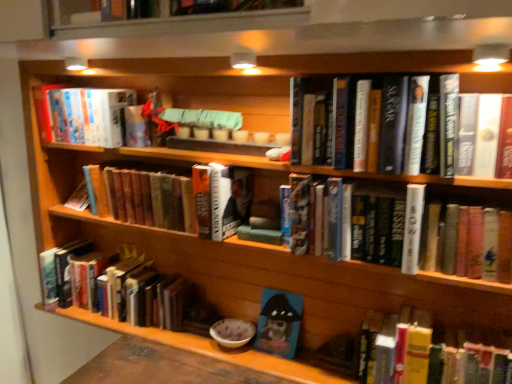
What is the approximate height of hardcover book at center, the second book in the top-to-bottom sequence?

10.00 inches.

What are the coordinates of `hardcover books at upper left, the 1th book when ordered from top to bottom` in the screenshot? It's located at (82, 114).

What is the approximate height of hardcover books at upper left, positioned as the 6th book in bottom-to-top order?

The height of hardcover books at upper left, positioned as the 6th book in bottom-to-top order, is 9.23 inches.

In order to click on blue textured canvas at center, which ranks as the first book in bottom-to-top order in this screenshot , I will do 279,323.

Is blue textured canvas at center, arranged as the sixth book when viewed from the top, far from hardcover book at center, positioned as the 5th book in bottom-to-top order?

They are positioned close to each other.

Between blue textured canvas at center, arranged as the sixth book when viewed from the top, and hardcover book at center, the second book in the top-to-bottom sequence, which one has smaller size?

Smaller between the two is blue textured canvas at center, arranged as the sixth book when viewed from the top.

From the picture: From the image's perspective, relative to hardcover book at center, positioned as the 5th book in bottom-to-top order, is blue textured canvas at center, which ranks as the first book in bottom-to-top order, above or below?

blue textured canvas at center, which ranks as the first book in bottom-to-top order, is situated lower than hardcover book at center, positioned as the 5th book in bottom-to-top order, in the image.

From the image's perspective, relative to hardcover book at center, the 4th book from the top, is hardcover books at upper left, the 1th book when ordered from top to bottom, above or below?

From the image's perspective, hardcover books at upper left, the 1th book when ordered from top to bottom, appears above hardcover book at center, the 4th book from the top.

From a real-world perspective, who is located higher, hardcover books at upper left, the 1th book when ordered from top to bottom, or hardcover book at center, the 4th book from the top?

hardcover books at upper left, the 1th book when ordered from top to bottom, from a real-world perspective.

Which object is positioned more to the right, hardcover books at upper left, positioned as the 6th book in bottom-to-top order, or hardcover book at center, which is the 3th book from bottom to top?

Positioned to the right is hardcover book at center, which is the 3th book from bottom to top.

Which is closer to the camera, (82, 106) or (356, 230)?

Point (82, 106) is positioned farther from the camera compared to point (356, 230).

How far apart are blue textured canvas at center, which ranks as the first book in bottom-to-top order, and hardcover book at lower left, the 2th book positioned from the bottom?

19.43 inches.

Is hardcover book at lower left, the 2th book positioned from the bottom, located within blue textured canvas at center, which ranks as the first book in bottom-to-top order?

Actually, hardcover book at lower left, the 2th book positioned from the bottom, is outside blue textured canvas at center, which ranks as the first book in bottom-to-top order.

Is blue textured canvas at center, arranged as the sixth book when viewed from the top, positioned far away from hardcover book at lower left, the 5th book positioned from the top?

No, blue textured canvas at center, arranged as the sixth book when viewed from the top, is not far from hardcover book at lower left, the 5th book positioned from the top.

From a real-world perspective, which is physically above, blue textured canvas at center, arranged as the sixth book when viewed from the top, or hardcover book at lower left, the 2th book positioned from the bottom?

In real-world perspective, hardcover book at lower left, the 2th book positioned from the bottom, is above.

From the image's perspective, between hardcover book at center, the 4th book from the top, and hardcover book at center, positioned as the 4th book in bottom-to-top order, which one is located above?

hardcover book at center, positioned as the 4th book in bottom-to-top order, appears higher in the image.

Which of these two, hardcover book at center, which is the 3th book from bottom to top, or hardcover book at center, positioned as the 3th book in top-to-bottom order, is thinner?

With smaller width is hardcover book at center, which is the 3th book from bottom to top.

You are a GUI agent. You are given a task and a screenshot of the screen. Output one action in this format:
    pyautogui.click(x=<x>, y=<y>)
    Task: Click on the 3rd book counting from the right side of the hardcover book at center, positioned as the 3th book in top-to-bottom order
    This screenshot has width=512, height=384.
    Given the screenshot: What is the action you would take?
    pyautogui.click(x=466, y=241)

Between hardcover book at center, the 4th book from the top, and hardcover book at center, positioned as the 4th book in bottom-to-top order, which one has more height?

Standing taller between the two is hardcover book at center, the 4th book from the top.

How different are the orientations of hardcover book at lower left, the 2th book positioned from the bottom, and blue textured canvas at center, which ranks as the first book in bottom-to-top order, in degrees?

The facing directions of hardcover book at lower left, the 2th book positioned from the bottom, and blue textured canvas at center, which ranks as the first book in bottom-to-top order, are 0.00258 degrees apart.

Which book is the 2nd one when counting from the right side of the hardcover book at lower left, the 5th book positioned from the top? Please provide its 2D coordinates.

[(279, 323)]

Considering the sizes of objects hardcover book at lower left, the 5th book positioned from the top, and blue textured canvas at center, which ranks as the first book in bottom-to-top order, in the image provided, who is taller, hardcover book at lower left, the 5th book positioned from the top, or blue textured canvas at center, which ranks as the first book in bottom-to-top order,?

hardcover book at lower left, the 5th book positioned from the top, is taller.

How much distance is there between hardcover book at center, positioned as the 4th book in bottom-to-top order, and hardcover books at upper left, positioned as the 6th book in bottom-to-top order?

They are 25.35 centimeters apart.

Can you see hardcover book at center, positioned as the 4th book in bottom-to-top order, touching hardcover books at upper left, positioned as the 6th book in bottom-to-top order?

No, hardcover book at center, positioned as the 4th book in bottom-to-top order, is not with hardcover books at upper left, positioned as the 6th book in bottom-to-top order.

From a real-world perspective, is hardcover book at center, positioned as the 3th book in top-to-bottom order, positioned above or below hardcover books at upper left, positioned as the 6th book in bottom-to-top order?

hardcover book at center, positioned as the 3th book in top-to-bottom order, is situated lower than hardcover books at upper left, positioned as the 6th book in bottom-to-top order, in the real world.

Is hardcover book at center, the second book in the top-to-bottom sequence, to the left of hardcover books at upper left, positioned as the 6th book in bottom-to-top order, from the viewer's perspective?

In fact, hardcover book at center, the second book in the top-to-bottom sequence, is to the right of hardcover books at upper left, positioned as the 6th book in bottom-to-top order.

Is hardcover books at upper left, positioned as the 6th book in bottom-to-top order, completely or partially inside hardcover book at center, the second book in the top-to-bottom sequence?

No, hardcover books at upper left, positioned as the 6th book in bottom-to-top order, is not surrounded by hardcover book at center, the second book in the top-to-bottom sequence.

Is hardcover book at center, the second book in the top-to-bottom sequence, positioned in front of hardcover books at upper left, positioned as the 6th book in bottom-to-top order?

That is True.

Considering the sizes of objects hardcover book at center, the second book in the top-to-bottom sequence, and hardcover books at upper left, positioned as the 6th book in bottom-to-top order, in the image provided, who is bigger, hardcover book at center, the second book in the top-to-bottom sequence, or hardcover books at upper left, positioned as the 6th book in bottom-to-top order,?

hardcover book at center, the second book in the top-to-bottom sequence.

Where is `book that is the 4th one when counting backward from the hardcover book at center, the second book in the top-to-bottom sequence`? book that is the 4th one when counting backward from the hardcover book at center, the second book in the top-to-bottom sequence is located at coordinates (279, 323).

Find the location of a particular element. This screenshot has height=384, width=512. book that is the 5th one when counting leftward from the hardcover book at center, the 4th book from the top is located at coordinates (82, 114).

Considering their positions, is hardcover books at upper left, positioned as the 6th book in bottom-to-top order, positioned further to hardcover book at center, positioned as the 3th book in top-to-bottom order, than blue textured canvas at center, which ranks as the first book in bottom-to-top order?

The object further to hardcover book at center, positioned as the 3th book in top-to-bottom order, is blue textured canvas at center, which ranks as the first book in bottom-to-top order.

From the image, which object appears to be farther from blue textured canvas at center, which ranks as the first book in bottom-to-top order, hardcover books at upper left, positioned as the 6th book in bottom-to-top order, or hardcover book at center, the 4th book from the top?

hardcover books at upper left, positioned as the 6th book in bottom-to-top order, is positioned further to the anchor blue textured canvas at center, which ranks as the first book in bottom-to-top order.

When comparing their distances from hardcover book at lower left, the 2th book positioned from the bottom, does hardcover books at upper left, the 1th book when ordered from top to bottom, or hardcover book at center, the 4th book from the top, seem closer?

Based on the image, hardcover books at upper left, the 1th book when ordered from top to bottom, appears to be nearer to hardcover book at lower left, the 2th book positioned from the bottom.

From the image, which object appears to be nearer to hardcover book at lower left, the 5th book positioned from the top, hardcover book at center, positioned as the 3th book in top-to-bottom order, or hardcover books at upper left, the 1th book when ordered from top to bottom?

Based on the image, hardcover book at center, positioned as the 3th book in top-to-bottom order, appears to be nearer to hardcover book at lower left, the 5th book positioned from the top.

From the image, which object appears to be nearer to hardcover book at center, which is the 3th book from bottom to top, blue textured canvas at center, arranged as the sixth book when viewed from the top, or hardcover book at center, the second book in the top-to-bottom sequence?

Among the two, hardcover book at center, the second book in the top-to-bottom sequence, is located nearer to hardcover book at center, which is the 3th book from bottom to top.

When comparing their distances from hardcover book at center, positioned as the 5th book in bottom-to-top order, does hardcover book at center, positioned as the 3th book in top-to-bottom order, or blue textured canvas at center, arranged as the sixth book when viewed from the top, seem closer?

Based on the image, hardcover book at center, positioned as the 3th book in top-to-bottom order, appears to be nearer to hardcover book at center, positioned as the 5th book in bottom-to-top order.

Based on their spatial positions, is hardcover books at upper left, positioned as the 6th book in bottom-to-top order, or hardcover book at center, positioned as the 4th book in bottom-to-top order, further from hardcover book at lower left, the 5th book positioned from the top?

Based on the image, hardcover books at upper left, positioned as the 6th book in bottom-to-top order, appears to be further to hardcover book at lower left, the 5th book positioned from the top.

Looking at this image, looking at the image, which one is located closer to hardcover book at lower left, the 5th book positioned from the top, blue textured canvas at center, which ranks as the first book in bottom-to-top order, or hardcover book at center, the 4th book from the top?

blue textured canvas at center, which ranks as the first book in bottom-to-top order, is positioned closer to the anchor hardcover book at lower left, the 5th book positioned from the top.

At what (x,y) coordinates should I click in order to perform the action: click on book between hardcover book at lower left, the 5th book positioned from the top, and blue textured canvas at center, arranged as the sixth book when viewed from the top, in the horizontal direction. Please return your answer as a coordinate pair (x, y). This screenshot has width=512, height=384. Looking at the image, I should click on (172, 198).

This screenshot has width=512, height=384. What are the coordinates of `book between hardcover book at center, positioned as the 3th book in top-to-bottom order, and hardcover book at center, positioned as the 5th book in bottom-to-top order` in the screenshot? It's located at (279, 323).